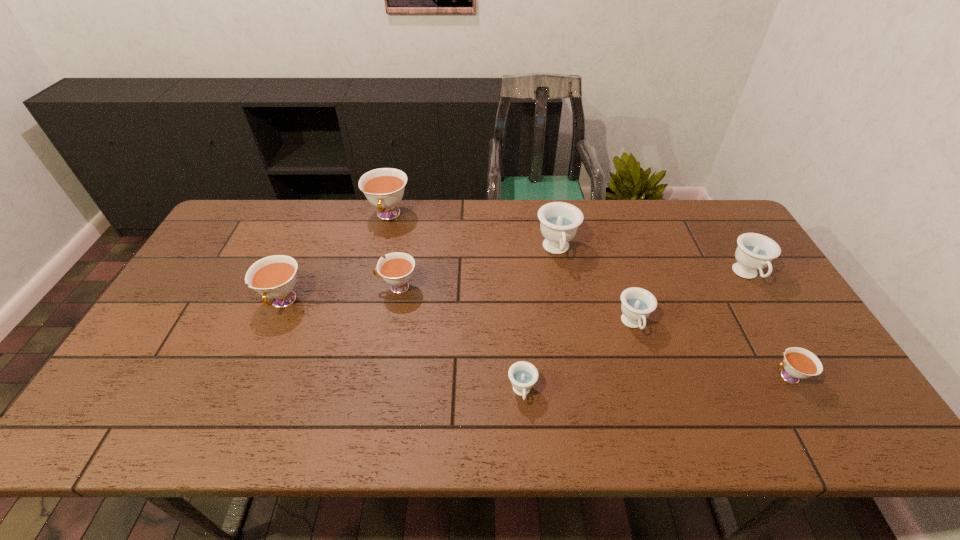
Find the location of a particular element. free spot that satisfies the following two spatial constraints: 1. on the side of the smallest white teacup with the handle; 2. on the side of the fourth object from left to right with the handle is located at coordinates (796, 392).